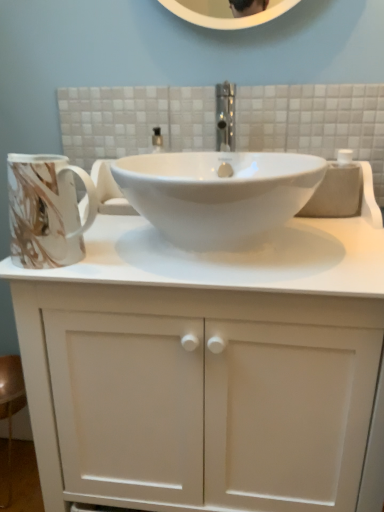
Describe the element at coordinates (46, 210) in the screenshot. The width and height of the screenshot is (384, 512). I see `marbled ceramic mug at left` at that location.

Locate an element on the screen. white matte cabinet at center is located at coordinates (194, 295).

Where is `mug above the white matte cabinet at center (from a real-world perspective)`? mug above the white matte cabinet at center (from a real-world perspective) is located at coordinates tap(46, 210).

Is marbled ceramic mug at left behind white matte cabinet at center?

Yes, it is.

Consider the image. Is marbled ceramic mug at left facing towards white matte cabinet at center?

Yes, marbled ceramic mug at left is aimed at white matte cabinet at center.

Is marbled ceramic mug at left bigger than white matte cabinet at center?

Actually, marbled ceramic mug at left might be smaller than white matte cabinet at center.

Is white matte cabinet at center touching white glossy sink at center?

Yes.

Which of these two, white matte cabinet at center or white glossy sink at center, is smaller?

Smaller between the two is white glossy sink at center.

Where is `counter top located behind the white matte cabinet at center`? This screenshot has width=384, height=512. counter top located behind the white matte cabinet at center is located at coordinates [x=236, y=256].

Between white matte cabinet at center and white glossy sink at center, which one has more height?

white matte cabinet at center is taller.

Which is behind, point (367, 254) or point (34, 226)?

The point (367, 254) is farther from the camera.

Would you say white glossy sink at center is to the left or to the right of marbled ceramic mug at left in the picture?

Based on their positions, white glossy sink at center is located to the right of marbled ceramic mug at left.

From the image's perspective, would you say white glossy sink at center is shown under marbled ceramic mug at left?

No, from the image's perspective, white glossy sink at center is not below marbled ceramic mug at left.

Considering the relative sizes of white glossy sink at center and marbled ceramic mug at left in the image provided, is white glossy sink at center shorter than marbled ceramic mug at left?

Indeed, white glossy sink at center has a lesser height compared to marbled ceramic mug at left.

Is marbled ceramic mug at left wider or thinner than white glossy sink at center?

Clearly, marbled ceramic mug at left has less width compared to white glossy sink at center.

From a real-world perspective, is marbled ceramic mug at left over white glossy sink at center?

Yes.

Is white glossy sink at center at the back of marbled ceramic mug at left?

No, marbled ceramic mug at left's orientation is not away from white glossy sink at center.

Looking at this image, would you consider marbled ceramic mug at left to be distant from white glossy sink at center?

No.

Considering the sizes of objects white matte cabinet at center and marbled ceramic mug at left in the image provided, who is bigger, white matte cabinet at center or marbled ceramic mug at left?

With larger size is white matte cabinet at center.

From the picture: Does white matte cabinet at center have a greater width compared to marbled ceramic mug at left?

Yes.

Who is shorter, white matte cabinet at center or marbled ceramic mug at left?

With less height is marbled ceramic mug at left.

Are white matte cabinet at center and marbled ceramic mug at left located far from each other?

white matte cabinet at center is actually quite close to marbled ceramic mug at left.

Who is smaller, white glossy sink at center or white matte cabinet at center?

With smaller size is white glossy sink at center.

Considering the positions of points (259, 283) and (283, 290), is point (259, 283) farther from camera compared to point (283, 290)?

No, it is in front of (283, 290).

Is white glossy sink at center in front of or behind white matte cabinet at center in the image?

Visually, white glossy sink at center is located behind white matte cabinet at center.

From a real-world perspective, which object rests below the other?

In real-world perspective, white matte cabinet at center is lower.

This screenshot has height=512, width=384. What are the coordinates of `bathroom cabinet located on the right of marbled ceramic mug at left` in the screenshot? It's located at (194, 295).

Find the location of a particular element. Image resolution: width=384 pixels, height=512 pixels. bathroom cabinet below the white glossy sink at center (from the image's perspective) is located at coordinates (194, 295).

Estimate the real-world distances between objects in this image. Which object is closer to white glossy sink at center, white matte cabinet at center or marbled ceramic mug at left?

white matte cabinet at center lies closer to white glossy sink at center than the other object.

Considering their positions, is white glossy sink at center positioned further to white matte cabinet at center than marbled ceramic mug at left?

Among the two, marbled ceramic mug at left is located further to white matte cabinet at center.

When comparing their distances from marbled ceramic mug at left, does white matte cabinet at center or white glossy sink at center seem further?

Based on the image, white matte cabinet at center appears to be further to marbled ceramic mug at left.

Considering their positions, is marbled ceramic mug at left positioned further to white glossy sink at center than white matte cabinet at center?

marbled ceramic mug at left lies further to white glossy sink at center than the other object.

Based on their spatial positions, is white glossy sink at center or white matte cabinet at center closer to marbled ceramic mug at left?

Based on the image, white glossy sink at center appears to be nearer to marbled ceramic mug at left.

Estimate the real-world distances between objects in this image. Which object is closer to white matte cabinet at center, marbled ceramic mug at left or white glossy sink at center?

Among the two, white glossy sink at center is located nearer to white matte cabinet at center.

Where is `mug that lies between white glossy sink at center and white matte cabinet at center from top to bottom`? The image size is (384, 512). mug that lies between white glossy sink at center and white matte cabinet at center from top to bottom is located at coordinates (46, 210).